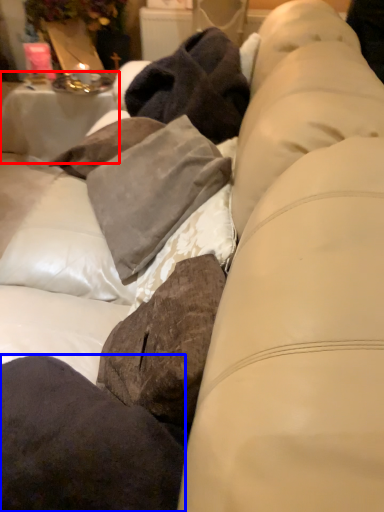
Question: Which object appears closest to the camera in this image, table (highlighted by a red box) or pillow (highlighted by a blue box)?

Choices:
 (A) table
 (B) pillow

Answer: (B)